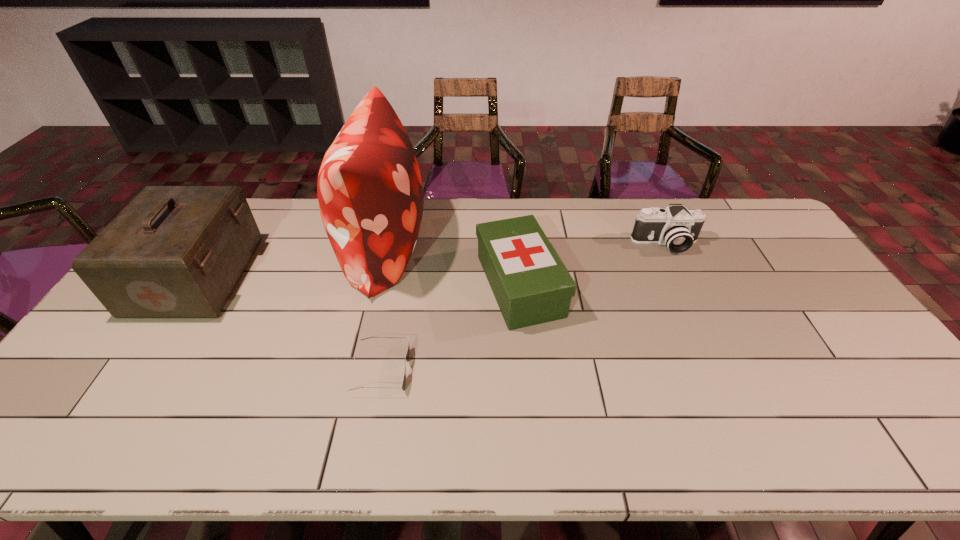
The image size is (960, 540). I want to click on free point between the shorter first-aid kit and the tallest object, so click(x=451, y=267).

Where is `vacant space that's between the fourth shortest object and the shortest object`? vacant space that's between the fourth shortest object and the shortest object is located at coordinates (290, 323).

The image size is (960, 540). I want to click on vacant space that is in between the tallest object and the shorter first-aid kit, so click(x=451, y=267).

Locate an element on the screen. This screenshot has width=960, height=540. vacant area that lies between the left first-aid kit and the tallest object is located at coordinates (291, 262).

Find the location of a particular element. vacant point located between the nearest object and the cushion is located at coordinates (382, 309).

Locate an element on the screen. free space between the rightmost object and the right first-aid kit is located at coordinates (592, 265).

Find the location of a particular element. vacant space that is in between the fourth shortest object and the sunglasses is located at coordinates (290, 323).

The image size is (960, 540). I want to click on empty location between the sunglasses and the taller first-aid kit, so click(290, 323).

This screenshot has width=960, height=540. I want to click on object that ranks as the closest to the cushion, so click(x=407, y=357).

This screenshot has height=540, width=960. I want to click on object that is the third nearest to the rightmost object, so [x=407, y=357].